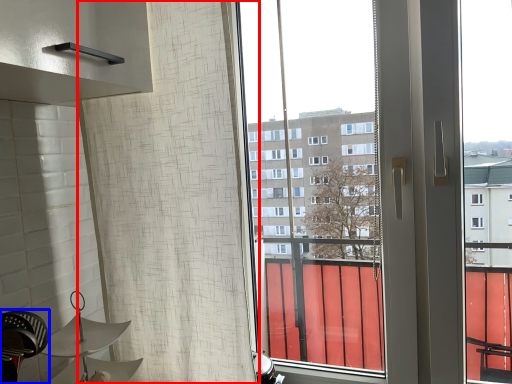
Question: Among these objects, which one is nearest to the camera, shower curtain (highlighted by a red box) or swivel chair (highlighted by a blue box)?

Choices:
 (A) shower curtain
 (B) swivel chair

Answer: (B)